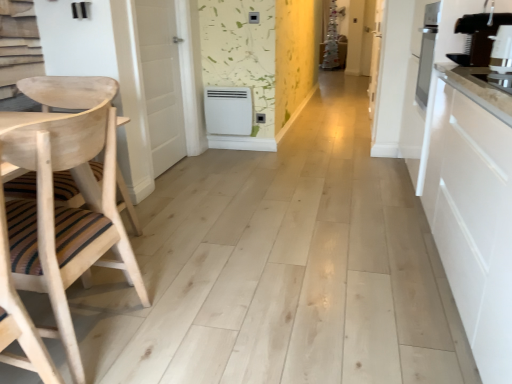
Locate an element on the screen. The height and width of the screenshot is (384, 512). free space to the back side of white wood door at center, which is the first door in back-to-front order is located at coordinates (357, 121).